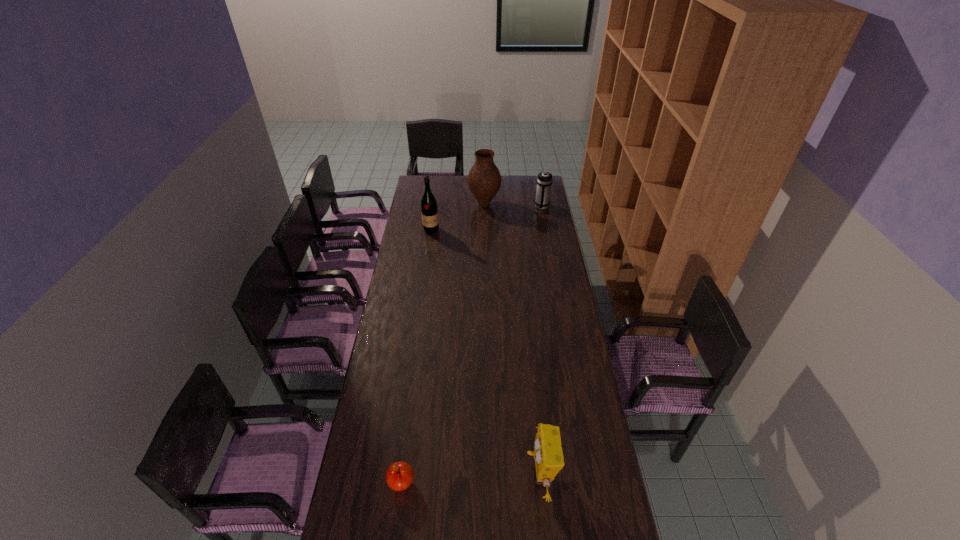
At what (x,y) coordinates should I click in order to perform the action: click on the third nearest object. Please return your answer as a coordinate pair (x, y). The image size is (960, 540). Looking at the image, I should click on [429, 210].

Identify the location of the third object from left to right. This screenshot has width=960, height=540. (484, 180).

Where is `thermos bottle`? thermos bottle is located at coordinates (544, 181).

At what (x,y) coordinates should I click in order to perform the action: click on the second object from right to left. Please return your answer as a coordinate pair (x, y). This screenshot has height=540, width=960. Looking at the image, I should click on (548, 454).

The height and width of the screenshot is (540, 960). Find the location of `the shortest object`. the shortest object is located at coordinates (399, 476).

The width and height of the screenshot is (960, 540). In order to click on free spot located 0.130m on the front-facing side of the third farthest object in this screenshot , I will do `click(428, 249)`.

At what (x,y) coordinates should I click in order to perform the action: click on vacant area situated on the front of the vase. Please return your answer as a coordinate pair (x, y). Looking at the image, I should click on (485, 219).

The width and height of the screenshot is (960, 540). Identify the location of vacant region located 0.280m on the side with the handle of the rightmost object. (548, 241).

Identify the location of vacant space located on the face of the sponge. This screenshot has width=960, height=540. (458, 475).

Where is `vacant space located on the face of the sponge`? The height and width of the screenshot is (540, 960). vacant space located on the face of the sponge is located at coordinates (493, 475).